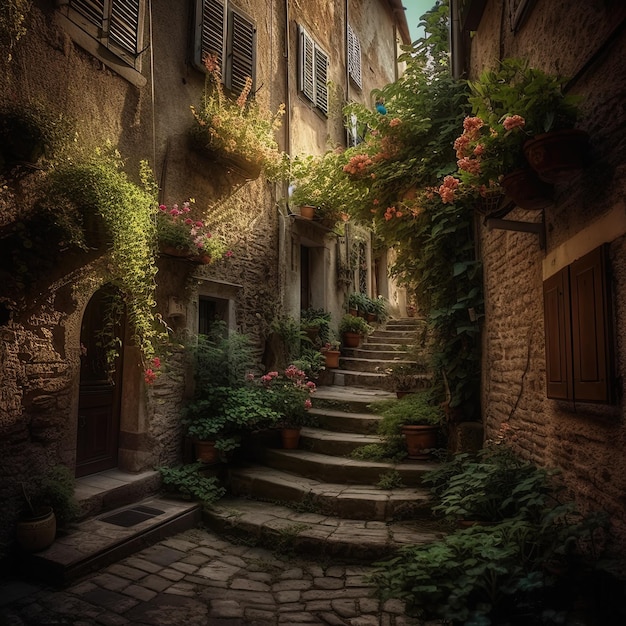
Identify the location of door. (91, 394).